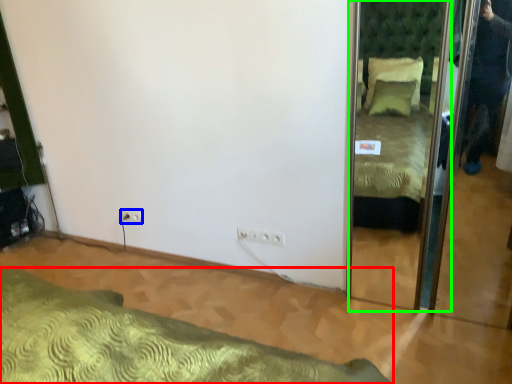
Question: Which object is positioned farthest from bed (highlighted by a red box)? Select from electric outlet (highlighted by a blue box) and mirror (highlighted by a green box).

Choices:
 (A) electric outlet
 (B) mirror

Answer: (B)